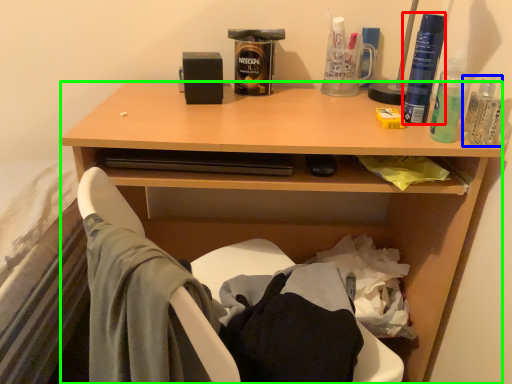
Question: Which object is positioned closest to bottle (highlighted by a red box)? Select from bottle (highlighted by a blue box) and desk (highlighted by a green box).

Choices:
 (A) bottle
 (B) desk

Answer: (A)